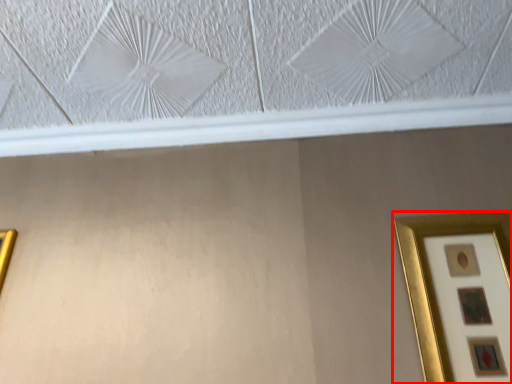
Question: From the image's perspective, what is the correct spatial positioning of picture frame (annotated by the red box) in reference to picture frame?

Choices:
 (A) below
 (B) above

Answer: (B)